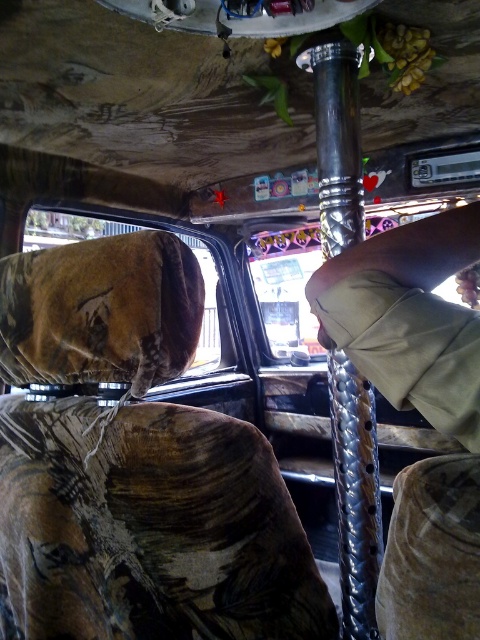
You are a passenger in the vehicle and want to hold onto something stable while the car is moving. Which object is better to grab between the polished metal pole at center and the camouflage fabric car window at upper left?

The polished metal pole at center is better to grab because it is a stable structure, while the camouflage fabric car window at upper left is part of the vehicle and cannot be held onto.

You are a passenger in the vehicle and want to grab the polished metal pole at center to steady yourself. Can you reach it without moving your seat closer? The camouflage fabric car window at upper left is blocking your view. Is the pole within arm reach?

The polished metal pole at center is closer to the viewer than the camouflage fabric car window at upper left, so yes, the pole is within arm reach since it is nearer to you than the window.